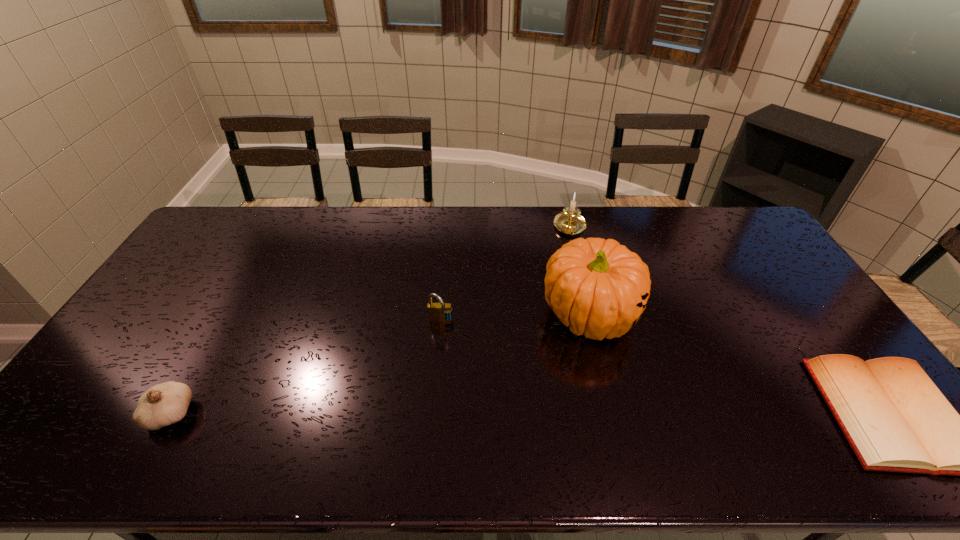
This screenshot has width=960, height=540. Identify the location of free spot located on the surface of the tallest object. (617, 418).

Find the location of a particular element. The image size is (960, 540). blank space located 0.180m on the surface of the tallest object is located at coordinates (616, 415).

At what (x,y) coordinates should I click in order to perform the action: click on vacant space situated 0.250m on the side with the combination dials of the padlock. Please return your answer as a coordinate pair (x, y). This screenshot has width=960, height=540. Looking at the image, I should click on (432, 404).

Where is `vacant region located on the side with the combination dials of the padlock`? vacant region located on the side with the combination dials of the padlock is located at coordinates (432, 401).

You are a GUI agent. You are given a task and a screenshot of the screen. Output one action in this format:
    pyautogui.click(x=<x>, y=<y>)
    Task: Click on the vacant area located on the side with the combination dials of the padlock
    The width and height of the screenshot is (960, 540).
    Given the screenshot: What is the action you would take?
    pyautogui.click(x=437, y=362)

Locate an element on the screen. This screenshot has width=960, height=540. object situated at the far edge is located at coordinates (570, 222).

The width and height of the screenshot is (960, 540). I want to click on object present at the near edge, so click(x=164, y=404).

This screenshot has width=960, height=540. In the image, there is a desktop. Find the location of `free space at the far edge`. free space at the far edge is located at coordinates (636, 215).

The image size is (960, 540). I want to click on vacant region at the near edge of the desktop, so [x=681, y=413].

Locate an element on the screen. Image resolution: width=960 pixels, height=540 pixels. free space at the left edge is located at coordinates (174, 308).